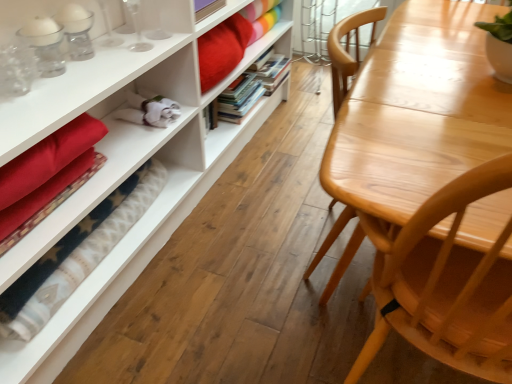
Question: Would you say matte white bookcase at left contains hardcover books at center, the 2th book viewed from the front?

Choices:
 (A) no
 (B) yes

Answer: (A)

Question: Would you say matte white bookcase at left is a long distance from hardcover books at center, arranged as the first book when viewed from the back?

Choices:
 (A) yes
 (B) no

Answer: (B)

Question: Is the position of matte white bookcase at left more distant than that of hardcover books at center, arranged as the first book when viewed from the back?

Choices:
 (A) no
 (B) yes

Answer: (A)

Question: Could you tell me if matte white bookcase at left is turned towards hardcover books at center, arranged as the first book when viewed from the back?

Choices:
 (A) yes
 (B) no

Answer: (B)

Question: Is matte white bookcase at left at the right side of hardcover books at center, the 2th book viewed from the front?

Choices:
 (A) no
 (B) yes

Answer: (B)

Question: Is point (253, 82) closer or farther from the camera than point (77, 289)?

Choices:
 (A) farther
 (B) closer

Answer: (A)

Question: In terms of height, does hardcover books at center, arranged as the second book when viewed from the back, look taller or shorter compared to matte white bookcase at left?

Choices:
 (A) tall
 (B) short

Answer: (A)

Question: From a real-world perspective, is hardcover books at center, arranged as the second book when viewed from the back, positioned above or below matte white bookcase at left?

Choices:
 (A) above
 (B) below

Answer: (A)

Question: In terms of size, does hardcover books at center, positioned as the first book in front-to-back order, appear bigger or smaller than matte white bookcase at left?

Choices:
 (A) big
 (B) small

Answer: (B)

Question: In terms of height, does hardcover books at center, the 2th book viewed from the front, look taller or shorter compared to matte white bookcase at left?

Choices:
 (A) short
 (B) tall

Answer: (B)

Question: Is hardcover books at center, the 2th book viewed from the front, wider or thinner than matte white bookcase at left?

Choices:
 (A) thin
 (B) wide

Answer: (A)

Question: From a real-world perspective, is hardcover books at center, the 2th book viewed from the front, above or below matte white bookcase at left?

Choices:
 (A) below
 (B) above

Answer: (B)

Question: Do you think hardcover books at center, the 2th book viewed from the front, is within matte white bookcase at left, or outside of it?

Choices:
 (A) outside
 (B) inside

Answer: (A)

Question: From the image's perspective, is velvet red blanket at lower left located above or below matte white bookcase at left?

Choices:
 (A) below
 (B) above

Answer: (A)

Question: Is velvet red blanket at lower left to the left or to the right of matte white bookcase at left in the image?

Choices:
 (A) left
 (B) right

Answer: (A)